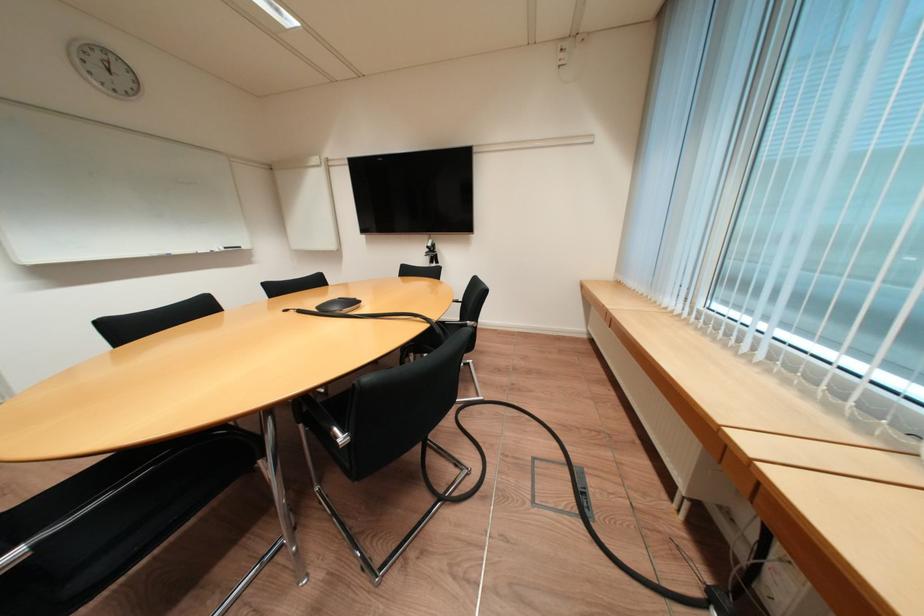
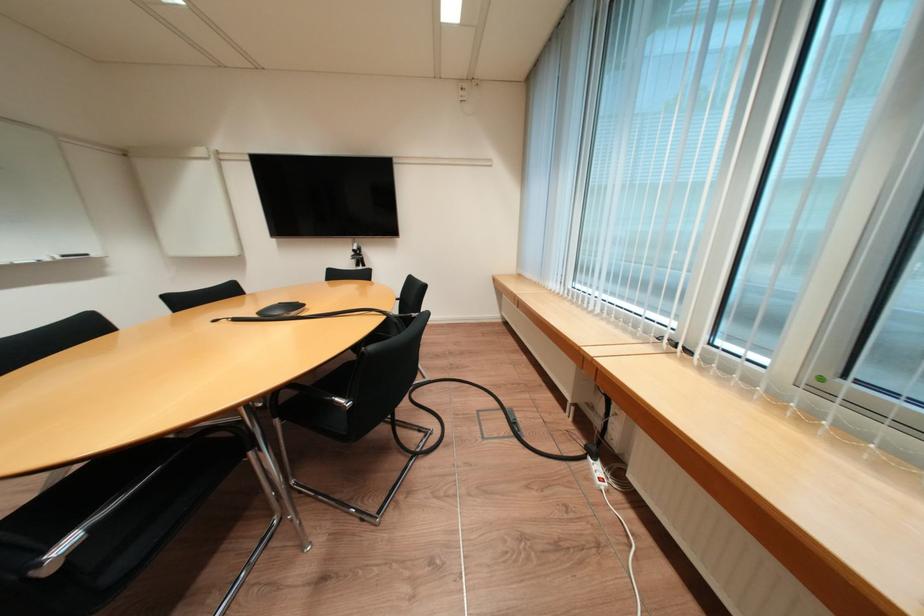
Where in the second image is the point corresponding to point (323, 312) from the first image?

(265, 318)